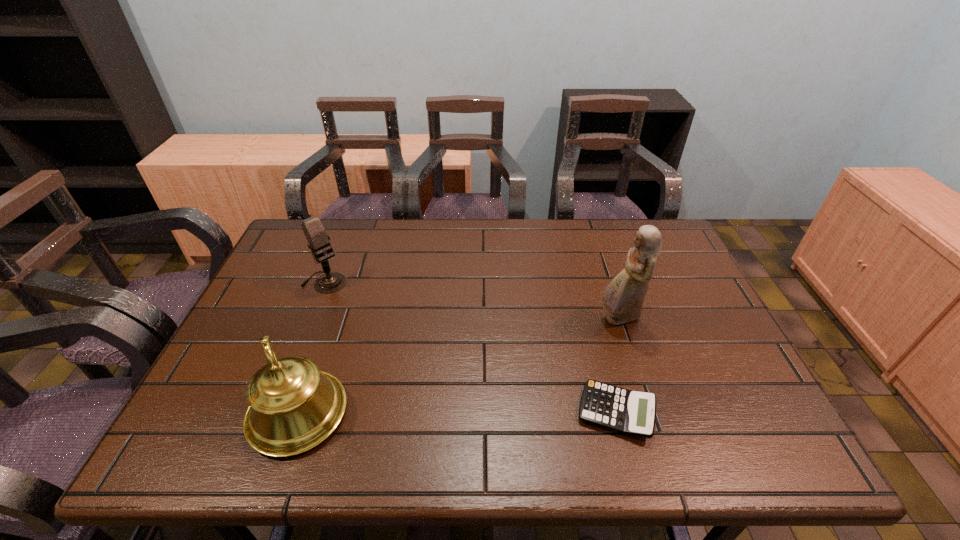
The width and height of the screenshot is (960, 540). I want to click on vacant space on the desktop that is between the bell and the calculator and is positioned on the front-facing side of the third nearest object, so click(x=504, y=413).

Where is `vacant space on the desktop that is between the bell and the calculator and is positioned on the front-facing side of the microphone`? vacant space on the desktop that is between the bell and the calculator and is positioned on the front-facing side of the microphone is located at coordinates (464, 413).